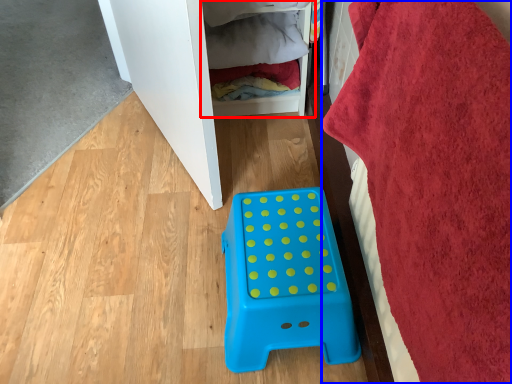
Question: Which object is closer to the camera taking this photo, shelf (highlighted by a red box) or bath towel (highlighted by a blue box)?

Choices:
 (A) shelf
 (B) bath towel

Answer: (B)